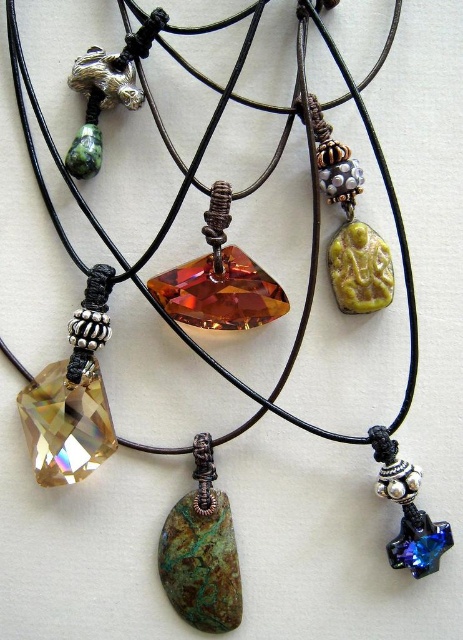
Question: Which of the following is the closest to the observer?

Choices:
 (A) green stone pendant at center
 (B) green carved stone at center-right

Answer: (B)

Question: Considering the relative positions of citrine crystal pendant at center and blue crystal star at lower right in the image provided, where is citrine crystal pendant at center located with respect to blue crystal star at lower right?

Choices:
 (A) right
 (B) left

Answer: (B)

Question: Which object is positioned closest to the iridescent glass pendant at center?

Choices:
 (A) green carved stone at center-right
 (B) citrine crystal pendant at center

Answer: (B)

Question: Can you confirm if citrine crystal pendant at center is smaller than blue crystal star at lower right?

Choices:
 (A) yes
 (B) no

Answer: (B)

Question: Where is green stone pendant at center located in relation to citrine crystal pendant at center in the image?

Choices:
 (A) right
 (B) left

Answer: (B)

Question: Estimate the real-world distances between objects in this image. Which object is closer to the citrine crystal pendant at center?

Choices:
 (A) blue crystal star at lower right
 (B) green stone pendant at center
 (C) iridescent glass pendant at center

Answer: (C)